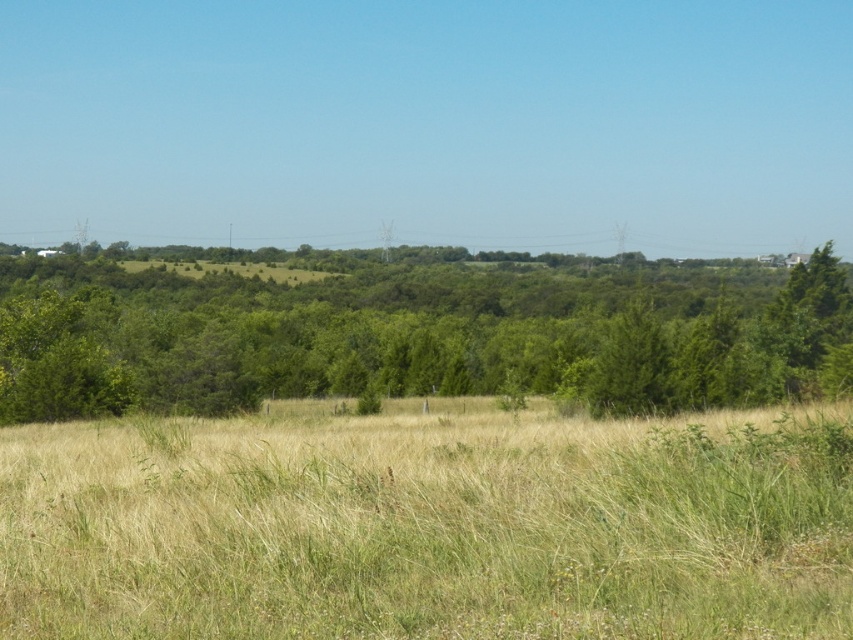
Question: Does dry grass at center appear over green leafy tree at center?

Choices:
 (A) yes
 (B) no

Answer: (B)

Question: Which object appears farthest from the camera in this image?

Choices:
 (A) green leafy tree at center
 (B) dry grass at center

Answer: (A)

Question: Is dry grass at center to the left of green leafy tree at center from the viewer's perspective?

Choices:
 (A) yes
 (B) no

Answer: (B)

Question: Which point is closer to the camera?

Choices:
 (A) (410, 358)
 (B) (132, 541)

Answer: (B)

Question: Which object appears closest to the camera in this image?

Choices:
 (A) green leafy tree at center
 (B) dry grass at center

Answer: (B)

Question: Can you confirm if dry grass at center is wider than green leafy tree at center?

Choices:
 (A) no
 (B) yes

Answer: (A)